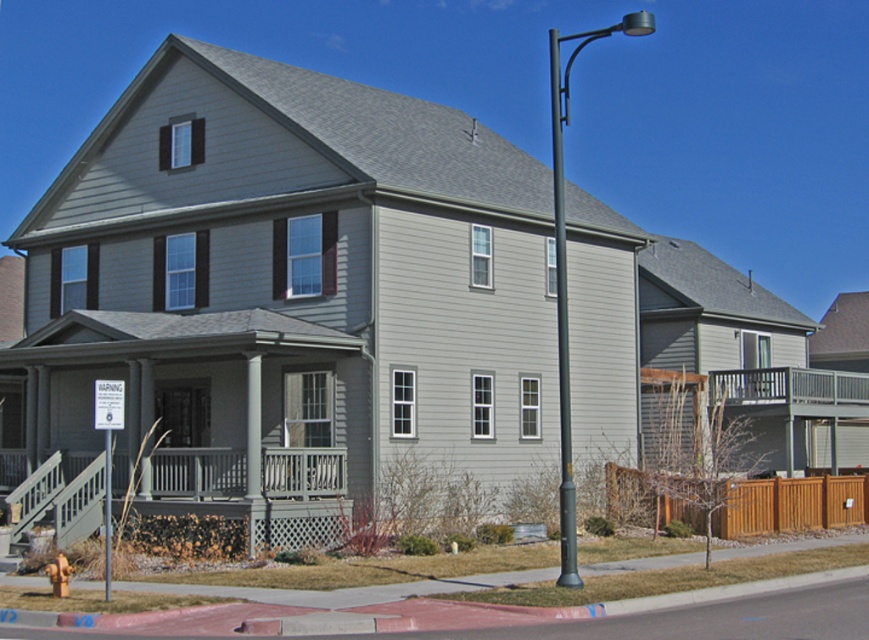
Who is positioned more to the right, matte gray porch at lower left or black metal pole at right?

black metal pole at right

Can you confirm if matte gray porch at lower left is bigger than black metal pole at right?

No.

Does point (308, 483) come closer to viewer compared to point (562, 474)?

No.

The image size is (869, 640). What are the coordinates of `matte gray porch at lower left` in the screenshot? It's located at point(261,490).

Is metallic gray pole at right above black metal pole at right?

Yes, metallic gray pole at right is above black metal pole at right.

Does point (564, 336) come farther from viewer compared to point (574, 545)?

Yes, it is.

Is point (559, 195) positioned behind point (562, 340)?

That is True.

Locate an element on the screen. Image resolution: width=869 pixels, height=640 pixels. metallic gray pole at right is located at coordinates (565, 273).

Does matte gray porch at lower left appear over metallic gray pole at right?

Incorrect, matte gray porch at lower left is not positioned above metallic gray pole at right.

Who is more distant from viewer, (38, 516) or (552, 168)?

Positioned behind is point (552, 168).

Image resolution: width=869 pixels, height=640 pixels. I want to click on matte gray porch at lower left, so click(x=261, y=490).